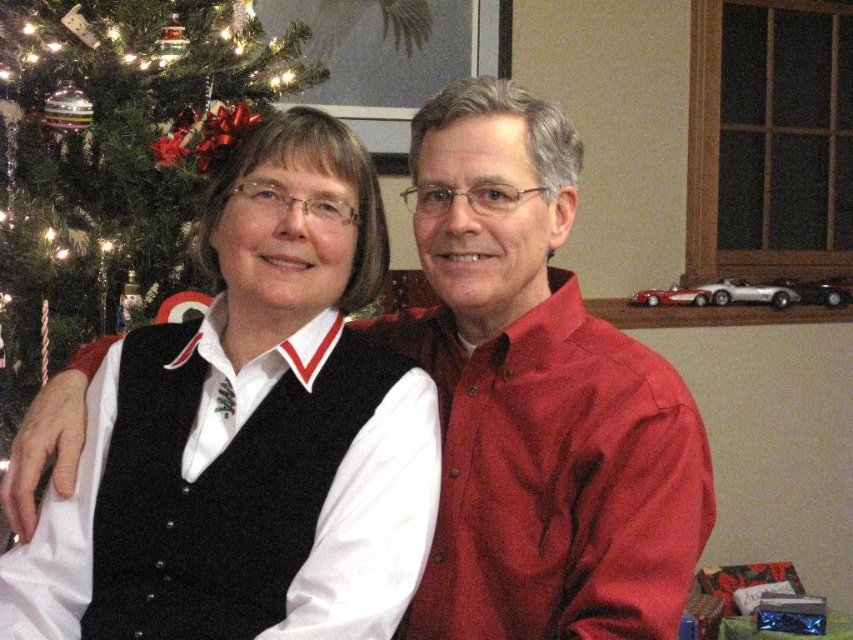
Question: Which of the following is the closest to the observer?

Choices:
 (A) green matte christmas tree at left
 (B) matte red shirt at center

Answer: (B)

Question: Does black wool vest at left have a smaller size compared to matte red shirt at center?

Choices:
 (A) no
 (B) yes

Answer: (B)

Question: Which point is farther from the camera taking this photo?

Choices:
 (A) (125, 428)
 (B) (495, 493)
 (C) (115, 156)

Answer: (C)

Question: Is matte red shirt at center closer to the viewer compared to green matte christmas tree at left?

Choices:
 (A) yes
 (B) no

Answer: (A)

Question: Which of the following is the farthest from the observer?

Choices:
 (A) (26, 93)
 (B) (563, 497)
 (C) (343, 481)

Answer: (A)

Question: Where is black wool vest at left located in relation to green matte christmas tree at left in the image?

Choices:
 (A) right
 (B) left

Answer: (A)